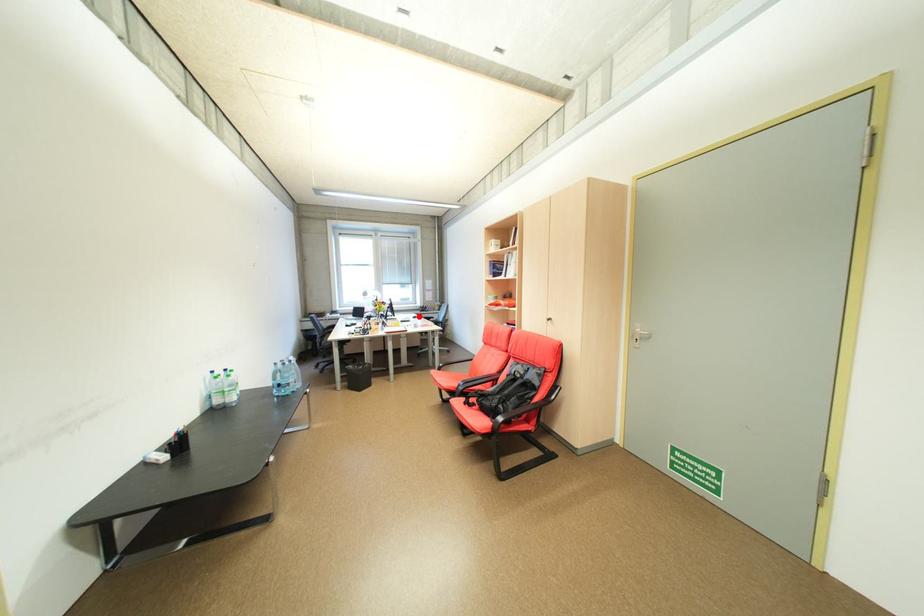
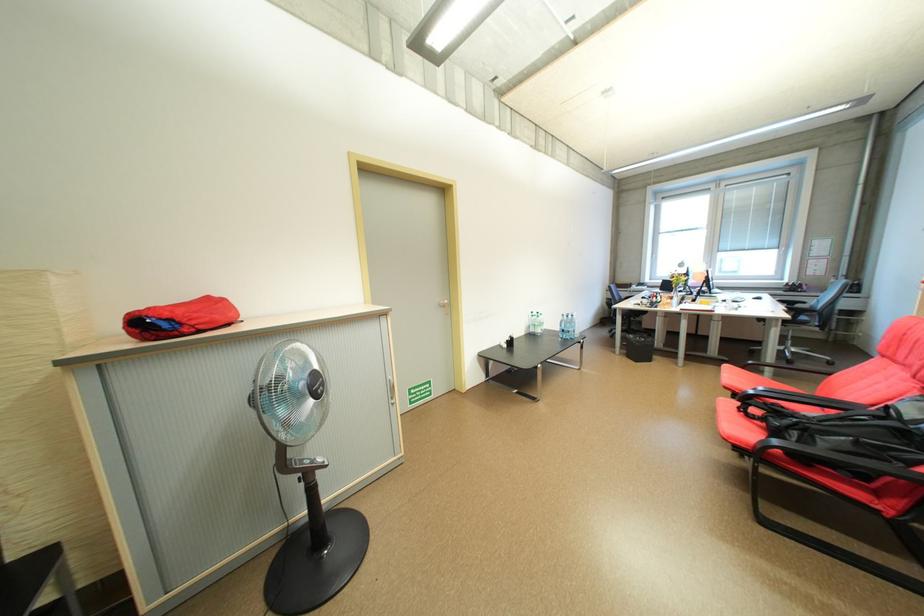
Locate, in the second image, the point that corresponds to the highlighted location in the first image.

(758, 296)